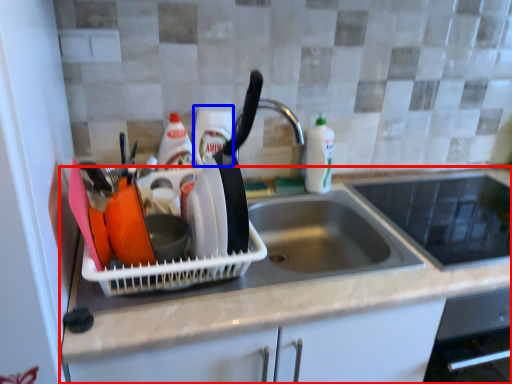
Question: Among these objects, which one is nearest to the camera, countertop (highlighted by a red box) or bottle (highlighted by a blue box)?

Choices:
 (A) countertop
 (B) bottle

Answer: (A)